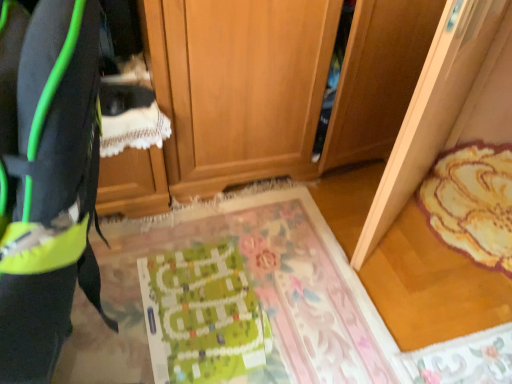
The width and height of the screenshot is (512, 384). Find the location of `vacant area on top of green paper at center (from a real-world perspective)`. vacant area on top of green paper at center (from a real-world perspective) is located at coordinates (203, 307).